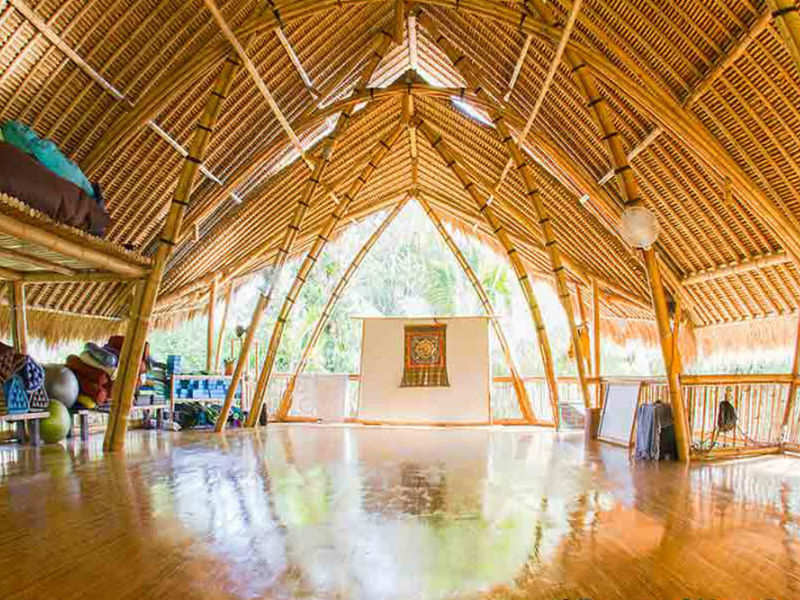
Find the location of a particular element. The width and height of the screenshot is (800, 600). rug is located at coordinates (426, 374).